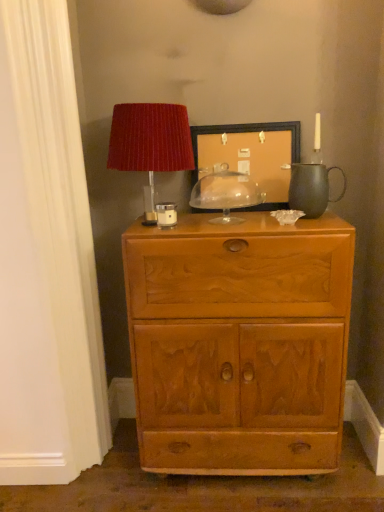
The height and width of the screenshot is (512, 384). What are the coordinates of `vacant region to the left of matte black teapot at right` in the screenshot? It's located at (274, 221).